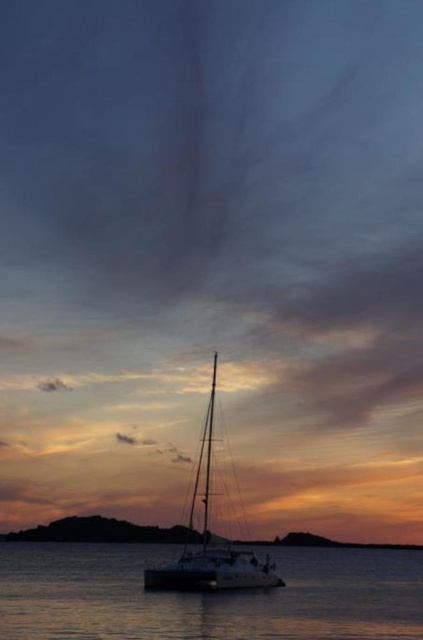
You are standing on the deck of the sailboat in the sunset scene. You see two points marked on the water. The first point is at coordinates point (208, 556) and the second point is at point (264, 544). Which point is closer to you?

Point (208, 556) is in front of point (264, 544), so it is closer to you.

You are standing on the deck of the sailboat and looking down at the water. Where is the silvery reflective water at lower center located relative to your position?

The silvery reflective water at lower center is located at point (x=206, y=596) relative to your position on the sailboat deck.